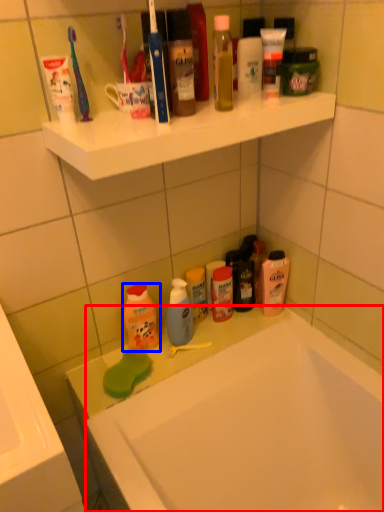
Question: Which of the following is the farthest to the observer, bathtub (highlighted by a red box) or cleaning product (highlighted by a blue box)?

Choices:
 (A) bathtub
 (B) cleaning product

Answer: (B)